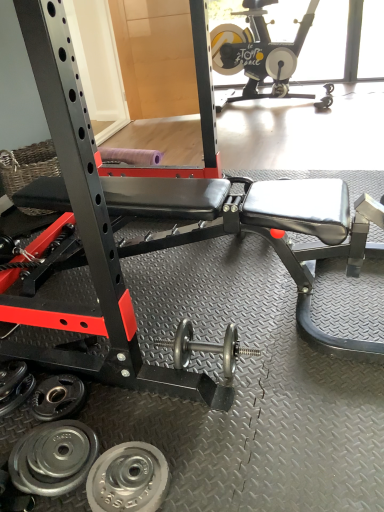
Find the location of a particular element. vacant space positioned to the left of polished silver dumbbell at center is located at coordinates (132, 402).